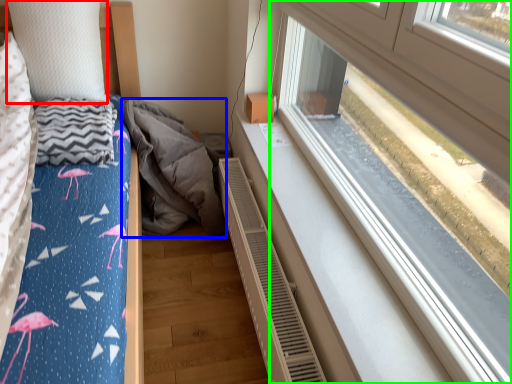
Question: Based on their relative distances, which object is farther from pillow (highlighted by a red box)? Choose from material (highlighted by a blue box) and window (highlighted by a green box).

Choices:
 (A) material
 (B) window

Answer: (B)